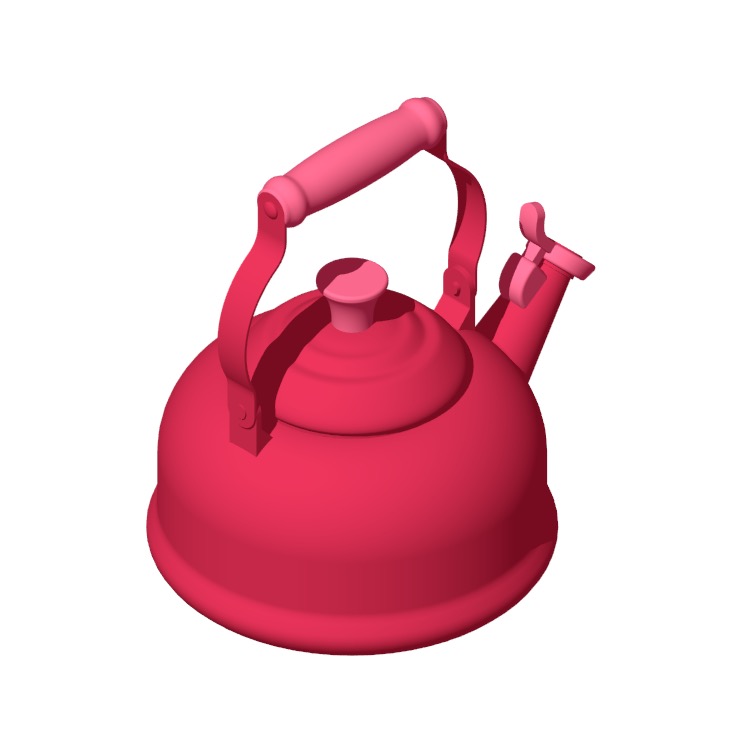
Identify the location of handle. (360, 171).